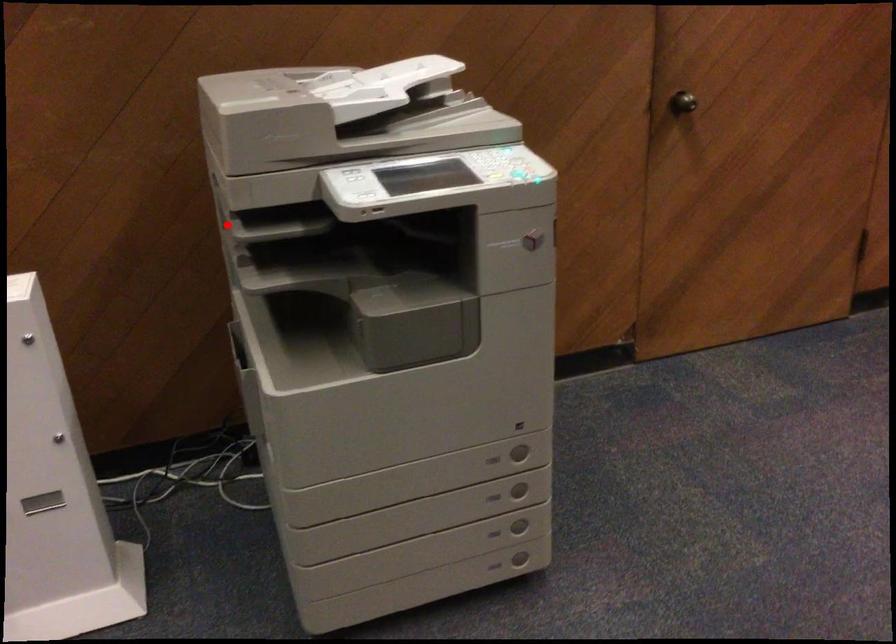
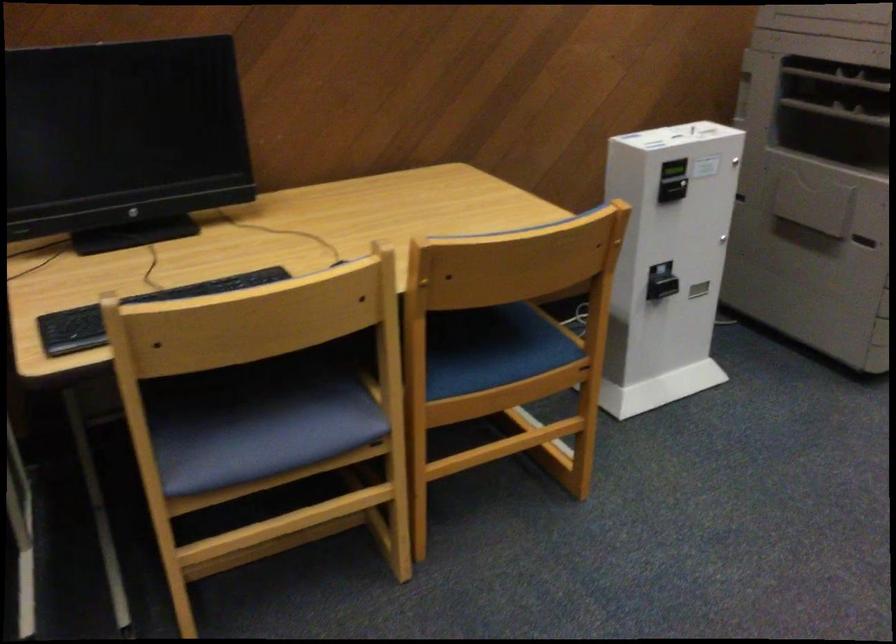
In the second image, find the point that corresponds to the highlighted location in the first image.

(839, 79)